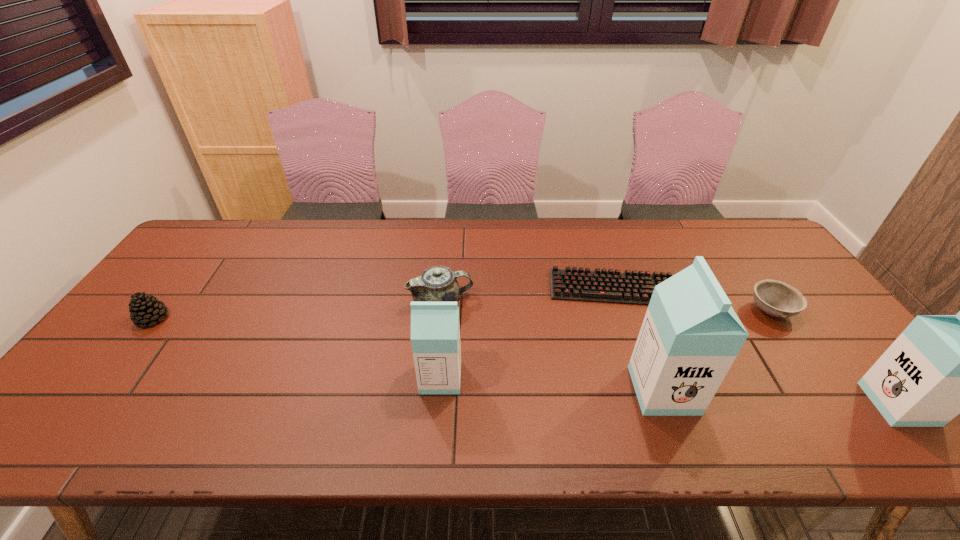
Find the location of a particular element. bowl present at the right edge is located at coordinates (775, 298).

You are a GUI agent. You are given a task and a screenshot of the screen. Output one action in this format:
    pyautogui.click(x=<x>, y=<y>)
    Task: Click on the object that is at the near right corner
    The width and height of the screenshot is (960, 540).
    Given the screenshot: What is the action you would take?
    pyautogui.click(x=940, y=366)

The image size is (960, 540). I want to click on vacant space at the far edge of the desktop, so click(x=450, y=247).

Where is `free space at the near edge of the desktop`? The width and height of the screenshot is (960, 540). free space at the near edge of the desktop is located at coordinates (747, 381).

Identify the location of vacant space at the left edge of the desktop. The image size is (960, 540). (189, 272).

The image size is (960, 540). Identify the location of vacant space at the right edge of the desktop. (813, 334).

In the image, there is a desktop. Identify the location of blank space at the near left corner. This screenshot has width=960, height=540. (137, 382).

In the image, there is a desktop. At what (x,y) coordinates should I click in order to perform the action: click on free space at the far right corner. Please return your answer as a coordinate pair (x, y). Looking at the image, I should click on (718, 228).

Where is `vacant space that's between the second milk carton from left to right and the fifth shortest object`? vacant space that's between the second milk carton from left to right and the fifth shortest object is located at coordinates (552, 384).

You are a GUI agent. You are given a task and a screenshot of the screen. Output one action in this format:
    pyautogui.click(x=<x>, y=<y>)
    Task: Click on the vacant area that lies between the pinecone and the shortest object
    The image size is (960, 540).
    Given the screenshot: What is the action you would take?
    pyautogui.click(x=383, y=303)